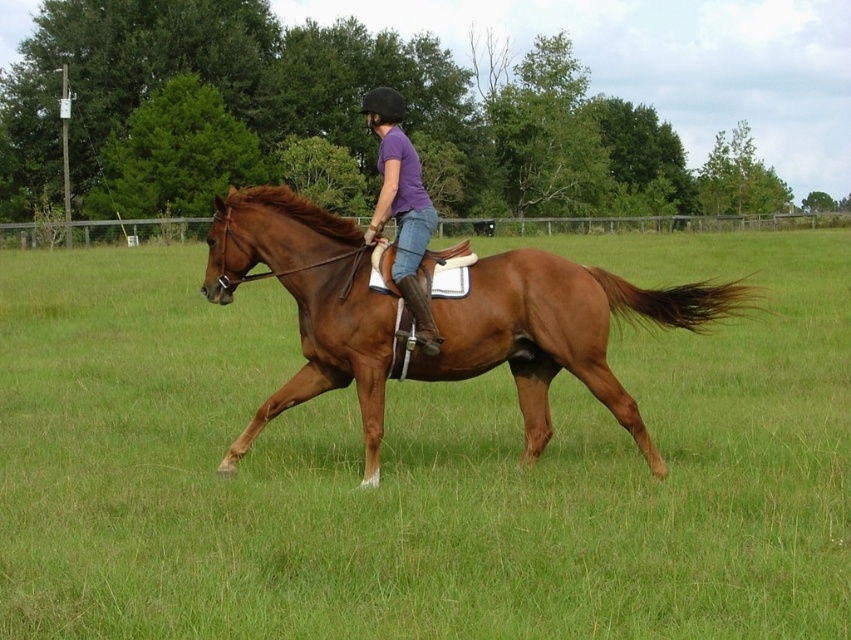
You are a photographer positioned at the edge of the field. You want to take a photo of both the brown leather horse at center and the brown glossy horse at center without any obstruction. Which horse should you position closer to the camera to ensure both are visible clearly?

You should position the brown leather horse at center closer to the camera because it is in front of the brown glossy horse at center. This way, the brown leather horse at center will not block the view of the brown glossy horse at center behind it.

You are standing in the field and want to reach the point marked as point (638, 502). If you walk directly towards it, how far will you have to walk?

The distance between you and point (638, 502) is 5.93 meters, so you will have to walk 5.93 meters to reach it.